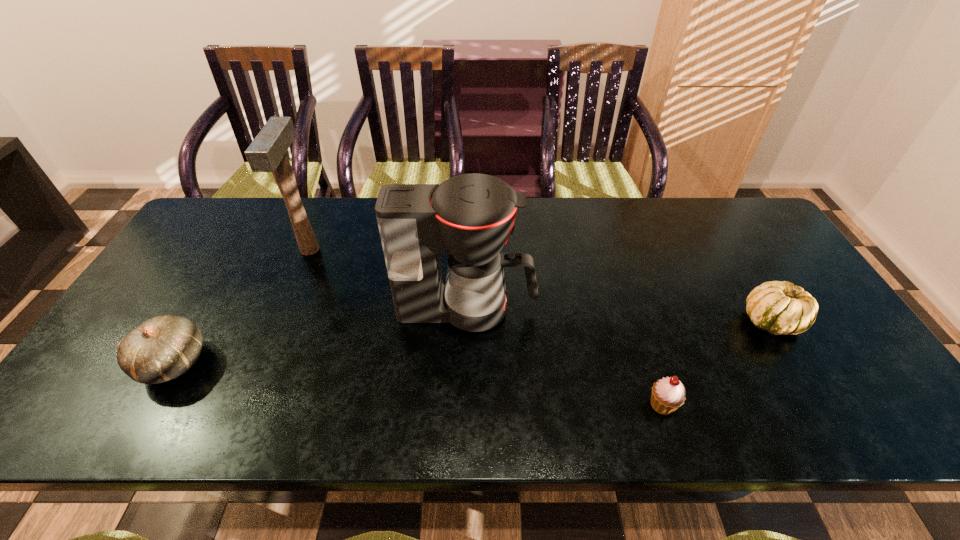
Identify the location of the fourth object from right to left. (267, 153).

What are the coordinates of `the farthest object` in the screenshot? It's located at (267, 153).

The height and width of the screenshot is (540, 960). What are the coordinates of `coffee maker` in the screenshot? It's located at (470, 216).

You are a GUI agent. You are given a task and a screenshot of the screen. Output one action in this format:
    pyautogui.click(x=<x>, y=<y>)
    Task: Click on the leftmost object
    Image resolution: width=960 pixels, height=540 pixels.
    Given the screenshot: What is the action you would take?
    pyautogui.click(x=162, y=348)

Image resolution: width=960 pixels, height=540 pixels. What are the coordinates of `the rightmost object` in the screenshot? It's located at coord(780,308).

What are the coordinates of `the second object from right to left` in the screenshot? It's located at (668, 394).

Where is `the shortest object`? This screenshot has height=540, width=960. the shortest object is located at coordinates (668, 394).

Where is `vacant space located on the right of the fourth object from right to left`? This screenshot has width=960, height=540. vacant space located on the right of the fourth object from right to left is located at coordinates (395, 250).

You are a GUI agent. You are given a task and a screenshot of the screen. Output one action in this format:
    pyautogui.click(x=<x>, y=<y>)
    Task: Click on the free space located 0.150m pour from the carafe of the coffee maker
    The image size is (960, 540).
    Given the screenshot: What is the action you would take?
    pyautogui.click(x=593, y=309)

Locate an element on the screen. The height and width of the screenshot is (540, 960). blank space located on the back of the left gourd is located at coordinates (241, 246).